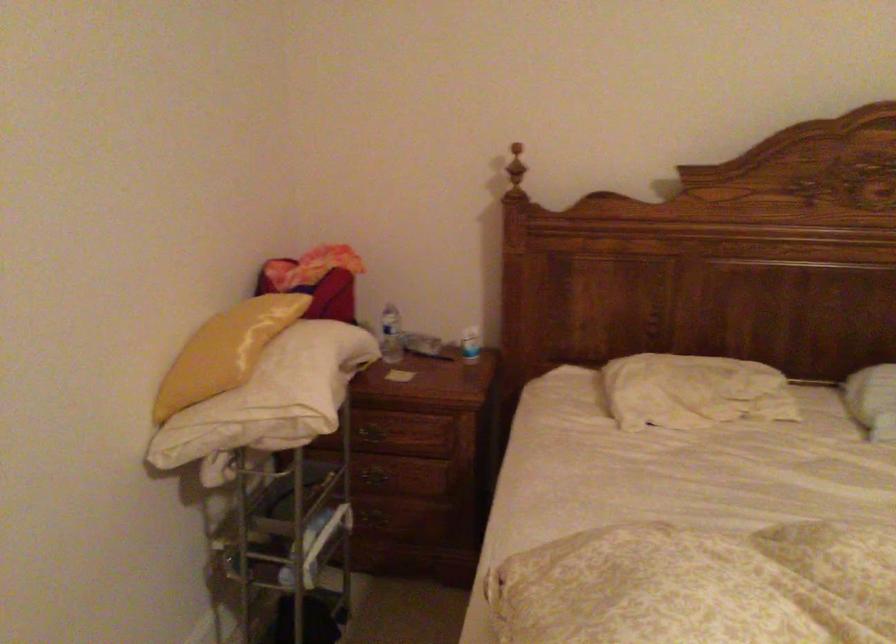
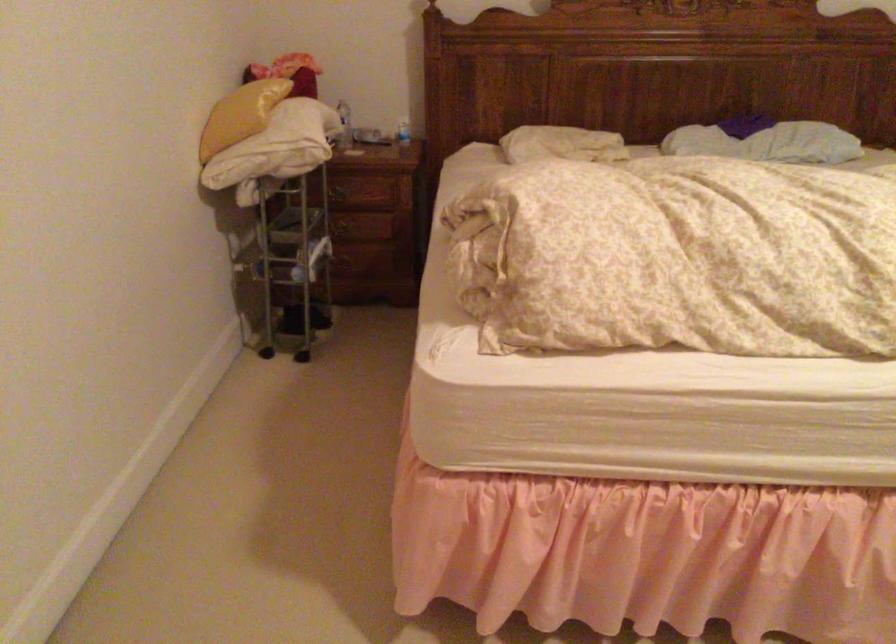
Locate, in the second image, the point that corresponds to point 375,354 in the first image.

(343, 125)